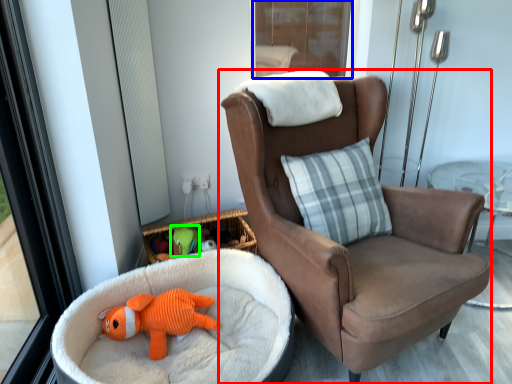
Question: Considering the real-world distances, which object is farthest from chair (highlighted by a red box)? screen door (highlighted by a blue box) or toy (highlighted by a green box)?

Choices:
 (A) screen door
 (B) toy

Answer: (A)